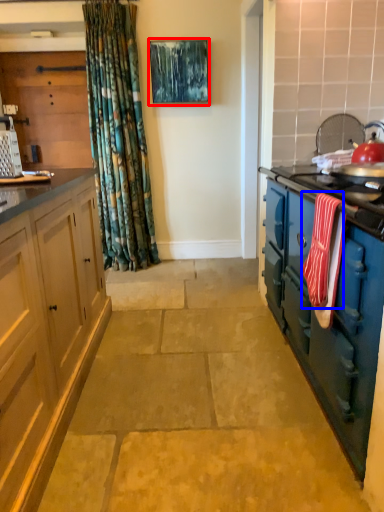
Question: Which point is closer to the camera, picture frame (highlighted by a red box) or material (highlighted by a blue box)?

Choices:
 (A) picture frame
 (B) material

Answer: (B)